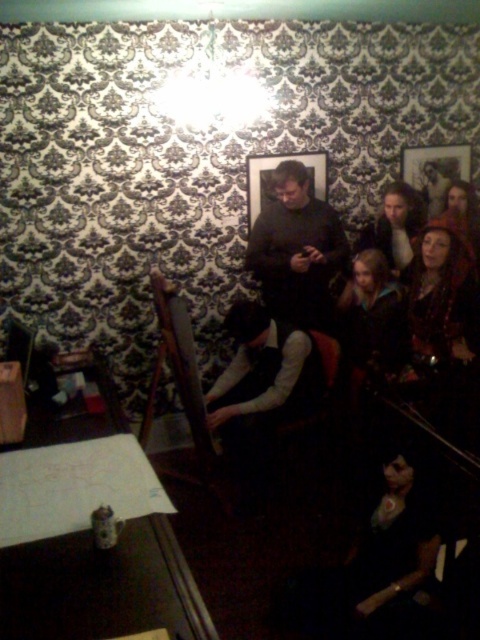
Question: Is dark gray sweater at center positioned before wooden picture frame at upper right?

Choices:
 (A) no
 (B) yes

Answer: (B)

Question: Considering the real-world distances, which object is closest to the dark gray sweater at center?

Choices:
 (A) wooden picture frame at upper center
 (B) wooden picture frame at upper right

Answer: (A)

Question: Can you confirm if wooden picture frame at upper right is bigger than wooden picture frame at upper center?

Choices:
 (A) no
 (B) yes

Answer: (A)

Question: Which of the following is the closest to the observer?

Choices:
 (A) (468, 150)
 (B) (290, 192)

Answer: (B)

Question: Can you confirm if dark gray sweater at center is wider than wooden picture frame at upper right?

Choices:
 (A) no
 (B) yes

Answer: (B)

Question: Which point is closer to the camera?

Choices:
 (A) dark gray sweater at center
 (B) wooden picture frame at upper right

Answer: (A)